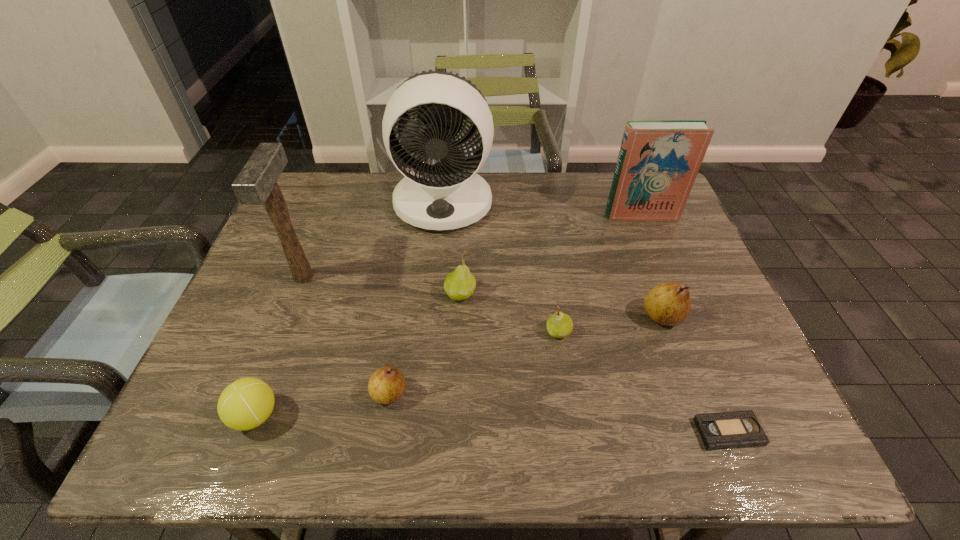
Locate an element on the screen. This screenshot has height=540, width=960. gray fan is located at coordinates (449, 194).

Where is `mallet`? The height and width of the screenshot is (540, 960). mallet is located at coordinates tap(256, 184).

Find the location of a particular element. hardback book is located at coordinates (658, 162).

Find the location of a particular element. the bigger brown pear is located at coordinates (669, 304).

Identify the location of the rightmost pear. (669, 304).

Identify the location of the farther green pear. The height and width of the screenshot is (540, 960). (460, 284).

Locate an element on the screen. This screenshot has width=960, height=540. the left green pear is located at coordinates (460, 284).

Where is `the fourth object from right to left`? the fourth object from right to left is located at coordinates (559, 325).

Locate an element on the screen. the smaller green pear is located at coordinates (559, 325).

Find the location of `the smaller brown pear`. the smaller brown pear is located at coordinates (386, 385).